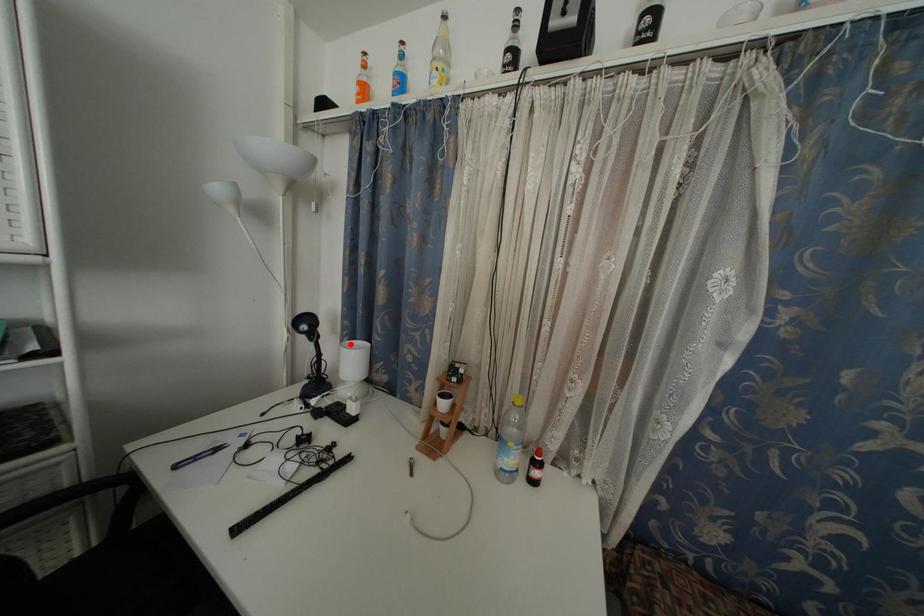
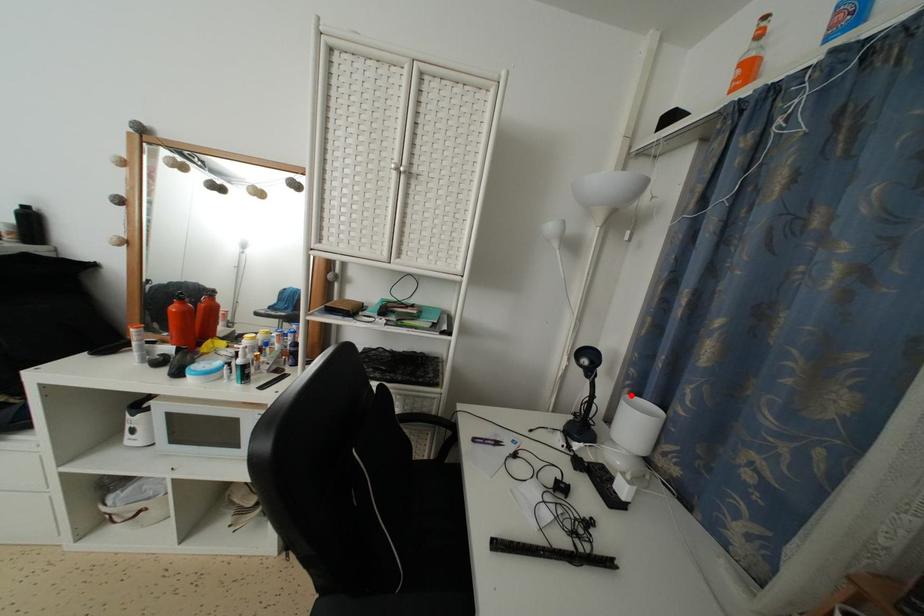
I am providing you with two images of the same scene from different viewpoints. A red point is marked on the first image and another point is marked on the second image. Does the point marked in image1 correspond to the same location as the one in image2?

Yes